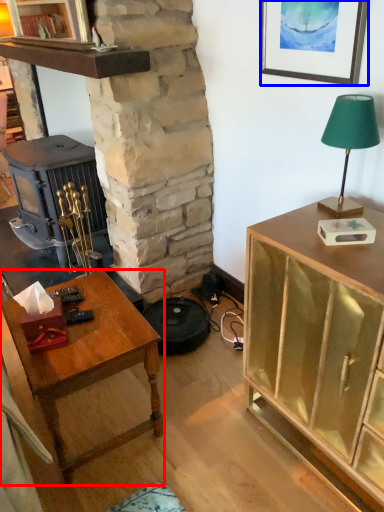
Question: Which of the following is the farthest to the observer, desk (highlighted by a red box) or picture frame (highlighted by a blue box)?

Choices:
 (A) desk
 (B) picture frame

Answer: (B)